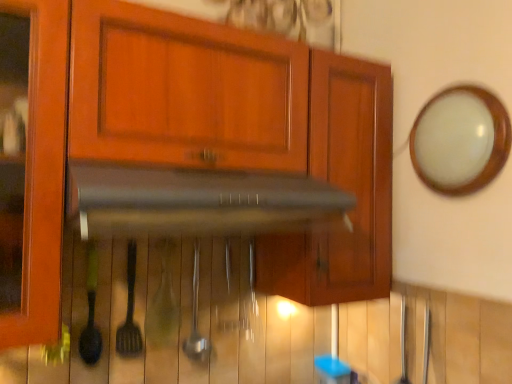
Measure the distance between metallic spatula at center, positioned as the 1th silverware in left-to-right order, and camera.

A distance of 3.95 feet exists between metallic spatula at center, positioned as the 1th silverware in left-to-right order, and camera.

At what (x,y) coordinates should I click in order to perform the action: click on black matte vent at center. Please return your answer as a coordinate pair (x, y). This screenshot has width=512, height=384. Looking at the image, I should click on (199, 202).

Locate an element on the screen. This screenshot has width=512, height=384. wooden cabinet at center is located at coordinates (200, 138).

The width and height of the screenshot is (512, 384). In order to click on satin silver spoon at center, placed as the second silverware when sorted from left to right in this screenshot , I will do `click(196, 318)`.

From a real-world perspective, between black matte vent at center and metallic spatula at center, positioned as the 1th silverware in left-to-right order, who is vertically lower?

From a 3D spatial view, metallic spatula at center, positioned as the 1th silverware in left-to-right order, is below.

At what (x,y) coordinates should I click in order to perform the action: click on the 1st silverware behind the black matte vent at center, counting from the anchor's position. Please return your answer as a coordinate pair (x, y). The height and width of the screenshot is (384, 512). Looking at the image, I should click on (130, 312).

From the picture: Which is behind, black matte vent at center or metallic spatula at center, which is counted as the 2th silverware, starting from the right?

metallic spatula at center, which is counted as the 2th silverware, starting from the right, is more distant.

Is black matte vent at center placed right next to metallic spatula at center, positioned as the 1th silverware in left-to-right order?

black matte vent at center and metallic spatula at center, positioned as the 1th silverware in left-to-right order, are clearly separated.

Who is bigger, satin silver spoon at center, placed as the second silverware when sorted from left to right, or wooden cabinet at center?

wooden cabinet at center.

Which object is positioned more to the left, satin silver spoon at center, the 1th silverware from the right, or wooden cabinet at center?

satin silver spoon at center, the 1th silverware from the right.

Is satin silver spoon at center, the 1th silverware from the right, far away from wooden cabinet at center?

They are positioned close to each other.

How different are the orientations of satin silver spoon at center, the 1th silverware from the right, and wooden cabinet at center in degrees?

The angular difference between satin silver spoon at center, the 1th silverware from the right, and wooden cabinet at center is 3.37 degrees.

Who is smaller, white glossy mirror at upper right or satin silver spoon at center, the 1th silverware from the right?

With smaller size is satin silver spoon at center, the 1th silverware from the right.

Consider the image. Can we say white glossy mirror at upper right lies outside satin silver spoon at center, the 1th silverware from the right?

That's correct, white glossy mirror at upper right is outside of satin silver spoon at center, the 1th silverware from the right.

Is white glossy mirror at upper right positioned far away from satin silver spoon at center, placed as the second silverware when sorted from left to right?

They are positioned close to each other.

Can you confirm if white glossy mirror at upper right is shorter than satin silver spoon at center, placed as the second silverware when sorted from left to right?

Indeed, white glossy mirror at upper right has a lesser height compared to satin silver spoon at center, placed as the second silverware when sorted from left to right.

How different are the orientations of metallic spatula at center, positioned as the 1th silverware in left-to-right order, and white glossy mirror at upper right in degrees?

The angular difference between metallic spatula at center, positioned as the 1th silverware in left-to-right order, and white glossy mirror at upper right is 87.3 degrees.

From a real-world perspective, does metallic spatula at center, positioned as the 1th silverware in left-to-right order, stand above white glossy mirror at upper right?

Incorrect, from a real-world perspective, metallic spatula at center, positioned as the 1th silverware in left-to-right order, is lower than white glossy mirror at upper right.

Which object is wider, metallic spatula at center, which is counted as the 2th silverware, starting from the right, or white glossy mirror at upper right?

white glossy mirror at upper right is wider.

Is satin silver spoon at center, placed as the second silverware when sorted from left to right, wider or thinner than metallic spatula at center, positioned as the 1th silverware in left-to-right order?

In the image, satin silver spoon at center, placed as the second silverware when sorted from left to right, appears to be wider than metallic spatula at center, positioned as the 1th silverware in left-to-right order.

Is satin silver spoon at center, the 1th silverware from the right, taller or shorter than metallic spatula at center, which is counted as the 2th silverware, starting from the right?

satin silver spoon at center, the 1th silverware from the right, is taller than metallic spatula at center, which is counted as the 2th silverware, starting from the right.

In the scene shown: Is satin silver spoon at center, placed as the second silverware when sorted from left to right, directly adjacent to metallic spatula at center, which is counted as the 2th silverware, starting from the right?

No, satin silver spoon at center, placed as the second silverware when sorted from left to right, is not next to metallic spatula at center, which is counted as the 2th silverware, starting from the right.

This screenshot has height=384, width=512. Find the location of `vent above the metallic spatula at center, positioned as the 1th silverware in left-to-right order (from a real-world perspective)`. vent above the metallic spatula at center, positioned as the 1th silverware in left-to-right order (from a real-world perspective) is located at coordinates 199,202.

Can you confirm if metallic spatula at center, which is counted as the 2th silverware, starting from the right, is smaller than black matte vent at center?

Indeed, metallic spatula at center, which is counted as the 2th silverware, starting from the right, has a smaller size compared to black matte vent at center.

Measure the distance between metallic spatula at center, positioned as the 1th silverware in left-to-right order, and black matte vent at center.

The distance of metallic spatula at center, positioned as the 1th silverware in left-to-right order, from black matte vent at center is 15.51 inches.

From a real-world perspective, is metallic spatula at center, which is counted as the 2th silverware, starting from the right, located higher than black matte vent at center?

No.

From a real-world perspective, who is located lower, satin silver spoon at center, the 1th silverware from the right, or white glossy mirror at upper right?

satin silver spoon at center, the 1th silverware from the right.

Which is closer to the camera, (198,357) or (433,122)?

The point (433,122) is closer.

Between satin silver spoon at center, placed as the second silverware when sorted from left to right, and white glossy mirror at upper right, which one appears on the left side from the viewer's perspective?

satin silver spoon at center, placed as the second silverware when sorted from left to right.

Identify the location of the 2nd silverware to the left of the black matte vent at center, counting from the anchor's position. The height and width of the screenshot is (384, 512). (130, 312).

Where is `cabinetry above the satin silver spoon at center, the 1th silverware from the right (from a real-world perspective)`? cabinetry above the satin silver spoon at center, the 1th silverware from the right (from a real-world perspective) is located at coordinates (200, 138).

Which object lies nearer to the anchor point wooden cabinet at center, black matte vent at center or metallic spatula at center, positioned as the 1th silverware in left-to-right order?

black matte vent at center lies closer to wooden cabinet at center than the other object.

Estimate the real-world distances between objects in this image. Which object is further from black matte vent at center, white glossy mirror at upper right or satin silver spoon at center, placed as the second silverware when sorted from left to right?

Based on the image, white glossy mirror at upper right appears to be further to black matte vent at center.

Considering their positions, is wooden cabinet at center positioned further to black matte vent at center than white glossy mirror at upper right?

white glossy mirror at upper right.

Based on the photo, based on their spatial positions, is white glossy mirror at upper right or black matte vent at center further from metallic spatula at center, positioned as the 1th silverware in left-to-right order?

white glossy mirror at upper right is positioned further to the anchor metallic spatula at center, positioned as the 1th silverware in left-to-right order.

From the picture: Estimate the real-world distances between objects in this image. Which object is further from white glossy mirror at upper right, black matte vent at center or metallic spatula at center, which is counted as the 2th silverware, starting from the right?

metallic spatula at center, which is counted as the 2th silverware, starting from the right.

When comparing their distances from wooden cabinet at center, does metallic spatula at center, positioned as the 1th silverware in left-to-right order, or white glossy mirror at upper right seem closer?

white glossy mirror at upper right is closer to wooden cabinet at center.

Estimate the real-world distances between objects in this image. Which object is closer to black matte vent at center, white glossy mirror at upper right or metallic spatula at center, which is counted as the 2th silverware, starting from the right?

Among the two, metallic spatula at center, which is counted as the 2th silverware, starting from the right, is located nearer to black matte vent at center.

Based on their spatial positions, is metallic spatula at center, positioned as the 1th silverware in left-to-right order, or satin silver spoon at center, the 1th silverware from the right, closer to black matte vent at center?

metallic spatula at center, positioned as the 1th silverware in left-to-right order, is positioned closer to the anchor black matte vent at center.

The image size is (512, 384). What are the coordinates of `silverware situated between metallic spatula at center, positioned as the 1th silverware in left-to-right order, and white glossy mirror at upper right from left to right` in the screenshot? It's located at (196, 318).

Find the location of a particular element. vent located between satin silver spoon at center, the 1th silverware from the right, and white glossy mirror at upper right in the left-right direction is located at coordinates (199, 202).

This screenshot has height=384, width=512. In order to click on cabinetry located between black matte vent at center and metallic spatula at center, which is counted as the 2th silverware, starting from the right, in the depth direction in this screenshot , I will do `click(200, 138)`.

The height and width of the screenshot is (384, 512). Find the location of `silverware between black matte vent at center and satin silver spoon at center, the 1th silverware from the right, along the z-axis`. silverware between black matte vent at center and satin silver spoon at center, the 1th silverware from the right, along the z-axis is located at coordinates (130, 312).